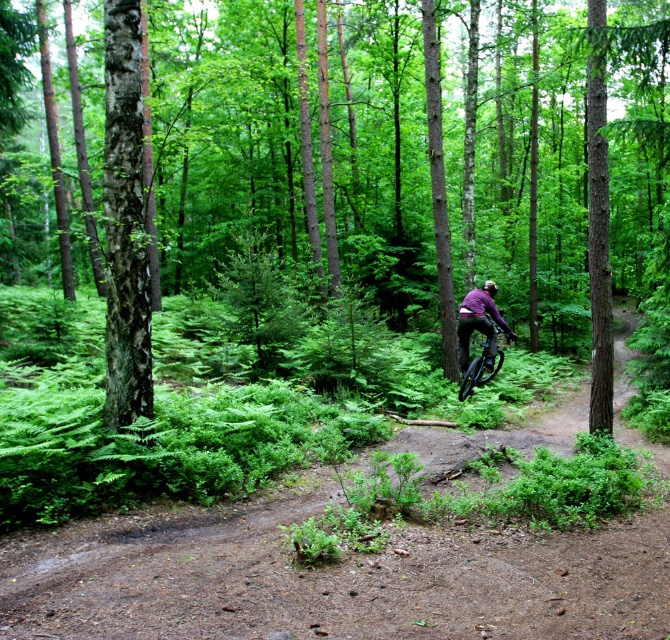
Can you confirm if brown dirt track at center is positioned to the right of smooth bark tree at left?

Indeed, brown dirt track at center is positioned on the right side of smooth bark tree at left.

Locate an element on the screen. brown dirt track at center is located at coordinates 330,577.

The width and height of the screenshot is (670, 640). In order to click on brown dirt track at center in this screenshot , I will do `click(330, 577)`.

Between point (586, 612) and point (488, 288), which one is positioned behind?

Point (488, 288)

Does point (239, 632) lie in front of point (486, 285)?

Yes, it is.

What are the coordinates of `brown dirt track at center` in the screenshot? It's located at (330, 577).

Can you confirm if green bark tree at center is smaller than matte purple helmet at center?

No.

Can you confirm if green bark tree at center is wider than matte purple helmet at center?

Yes.

Describe the element at coordinates (293, 147) in the screenshot. The width and height of the screenshot is (670, 640). I see `green bark tree at center` at that location.

At what (x,y) coordinates should I click in order to perform the action: click on green bark tree at center. Please return your answer as a coordinate pair (x, y). Looking at the image, I should click on (293, 147).